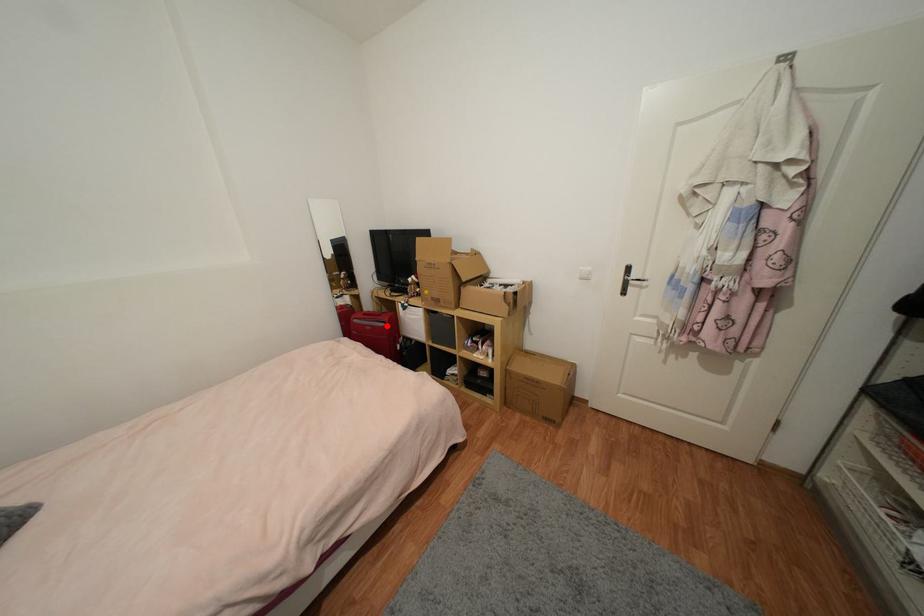
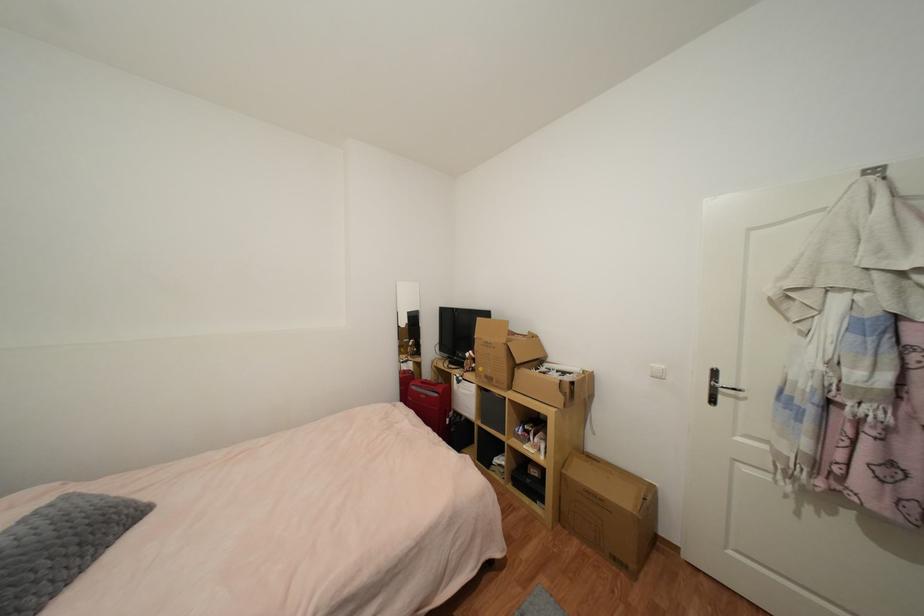
Locate, in the second image, the point that corresponds to the highlighted location in the first image.

(440, 397)